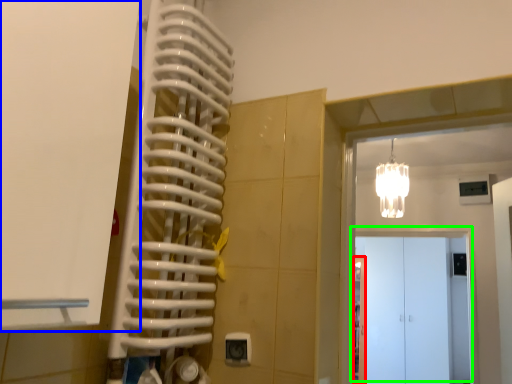
Question: Considering the real-world distances, which object is farthest from door (highlighted by a red box)? door (highlighted by a blue box) or door (highlighted by a green box)?

Choices:
 (A) door
 (B) door

Answer: (A)